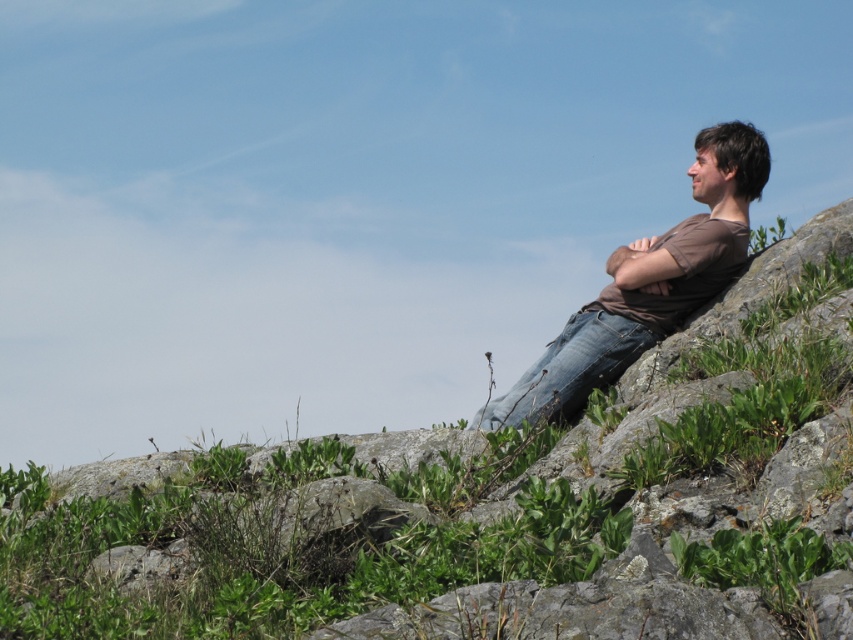
Is green grassy hillside at right wider than brown cotton shirt at right?

Correct, the width of green grassy hillside at right exceeds that of brown cotton shirt at right.

Who is positioned more to the left, green grassy hillside at right or brown cotton shirt at right?

green grassy hillside at right

The image size is (853, 640). Find the location of `green grassy hillside at right`. green grassy hillside at right is located at coordinates (463, 500).

Does point (809, 417) come behind point (627, 333)?

No, it is not.

Who is higher up, green grassy hillside at right or jeans at right?

jeans at right is above.

Locate an element on the screen. The image size is (853, 640). green grassy hillside at right is located at coordinates (463, 500).

Which is above, brown cotton shirt at right or jeans at right?

brown cotton shirt at right

Does point (556, 349) lie in front of point (575, 401)?

No, (556, 349) is behind (575, 401).

Which is behind, point (619, 248) or point (537, 412)?

Positioned behind is point (619, 248).

This screenshot has width=853, height=640. Identify the location of brown cotton shirt at right. (647, 284).